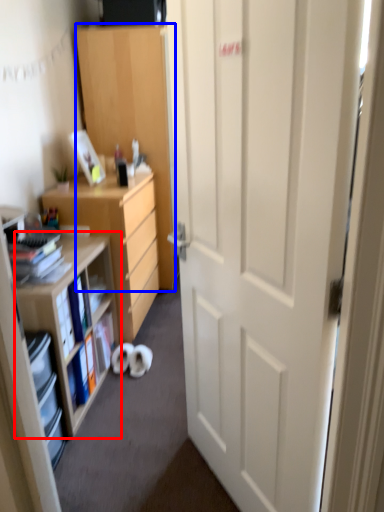
Question: Which point is closer to the camera, shelf (highlighted by a red box) or cabinetry (highlighted by a blue box)?

Choices:
 (A) shelf
 (B) cabinetry

Answer: (A)